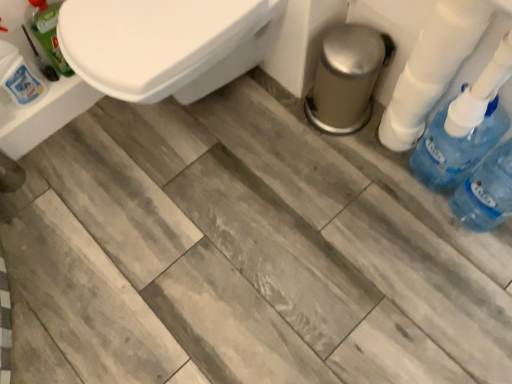
Question: Is white plastic toilet paper at right at the right side of blue translucent bottle at right?

Choices:
 (A) no
 (B) yes

Answer: (A)

Question: From a real-world perspective, is white plastic toilet paper at right below blue translucent bottle at right?

Choices:
 (A) yes
 (B) no

Answer: (B)

Question: Is blue translucent bottle at right at the back of white plastic toilet paper at right?

Choices:
 (A) yes
 (B) no

Answer: (B)

Question: Considering the relative sizes of white plastic toilet paper at right and blue translucent bottle at right in the image provided, is white plastic toilet paper at right bigger than blue translucent bottle at right?

Choices:
 (A) yes
 (B) no

Answer: (B)

Question: Does white plastic toilet paper at right turn towards blue translucent bottle at right?

Choices:
 (A) yes
 (B) no

Answer: (B)

Question: From the image's perspective, is white plastic toilet paper at right on top of blue translucent bottle at right?

Choices:
 (A) no
 (B) yes

Answer: (B)

Question: Is blue translucent bottle at right positioned in front of translucent plastic bottle at upper left, the third cleaning product when ordered from right to left?

Choices:
 (A) no
 (B) yes

Answer: (B)

Question: Is blue translucent bottle at right with translucent plastic bottle at upper left, the first cleaning product in the left-to-right sequence?

Choices:
 (A) yes
 (B) no

Answer: (B)

Question: Is blue translucent bottle at right taller than translucent plastic bottle at upper left, the first cleaning product in the left-to-right sequence?

Choices:
 (A) no
 (B) yes

Answer: (B)

Question: Considering the relative sizes of blue translucent bottle at right and translucent plastic bottle at upper left, the third cleaning product when ordered from right to left, in the image provided, is blue translucent bottle at right bigger than translucent plastic bottle at upper left, the third cleaning product when ordered from right to left,?

Choices:
 (A) yes
 (B) no

Answer: (A)

Question: Can you confirm if blue translucent bottle at right is smaller than translucent plastic bottle at upper left, the first cleaning product in the left-to-right sequence?

Choices:
 (A) yes
 (B) no

Answer: (B)

Question: Does blue translucent bottle at right lie behind translucent plastic bottle at upper left, the first cleaning product in the left-to-right sequence?

Choices:
 (A) yes
 (B) no

Answer: (B)

Question: From the image's perspective, does white plastic toilet paper at right appear lower than translucent plastic bottle at upper left, the third cleaning product when ordered from right to left?

Choices:
 (A) no
 (B) yes

Answer: (B)